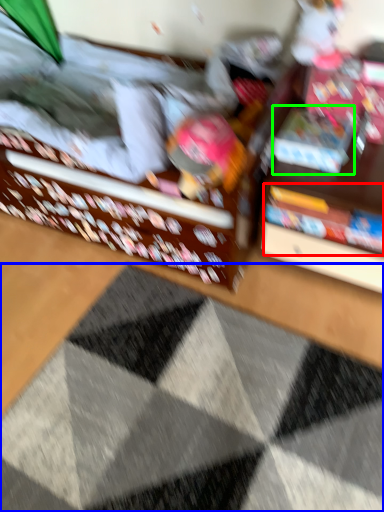
Question: Which object is positioned farthest from book (highlighted by a red box)? Select from doormat (highlighted by a blue box) and book (highlighted by a green box).

Choices:
 (A) doormat
 (B) book

Answer: (A)